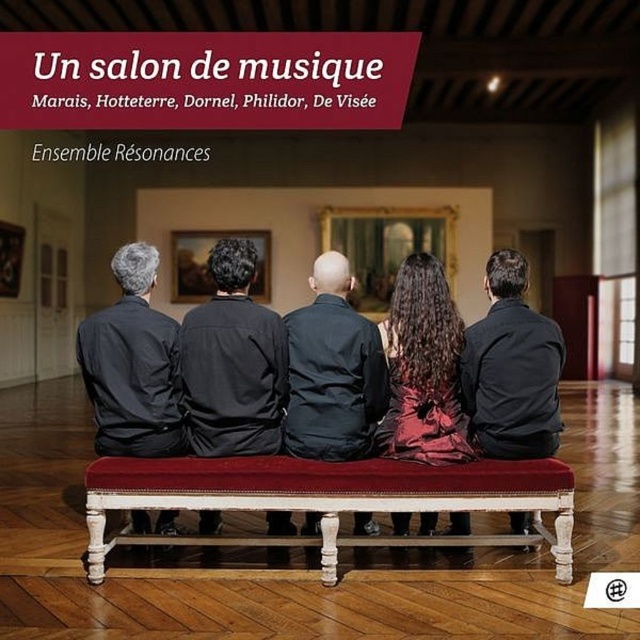
You are a photographer preparing to take a group photo of the individuals on the long, red upholstered bench with white wooden legs. You notice the matte black shirt at left and the black matte shirt at center. Which person should you ask to move closer to avoid being too far apart, based on their shirt widths?

The matte black shirt at left is wider than the black matte shirt at center, so you should ask the person wearing the matte black shirt at left to move closer to the person with the black matte shirt at center to reduce the distance between them.

You are a photographer setting up a shoot in the room. You need to position a small tripod between the matte black shirt at left and the dark gray fabric jacket at center. Considering their sizes, will the space between them be sufficient for the tripod?

The matte black shirt at left occupies less space than the dark gray fabric jacket at center, so the space between them might be sufficient for the tripod depending on the jacket size.

You are standing in the historical room and want to know which of the two items, the matte black shirt at left or the dark gray fabric jacket at center, is taller. Can you determine this based on their positions?

The matte black shirt at left has a greater height compared to the dark gray fabric jacket at center, so the matte black shirt at left is taller.